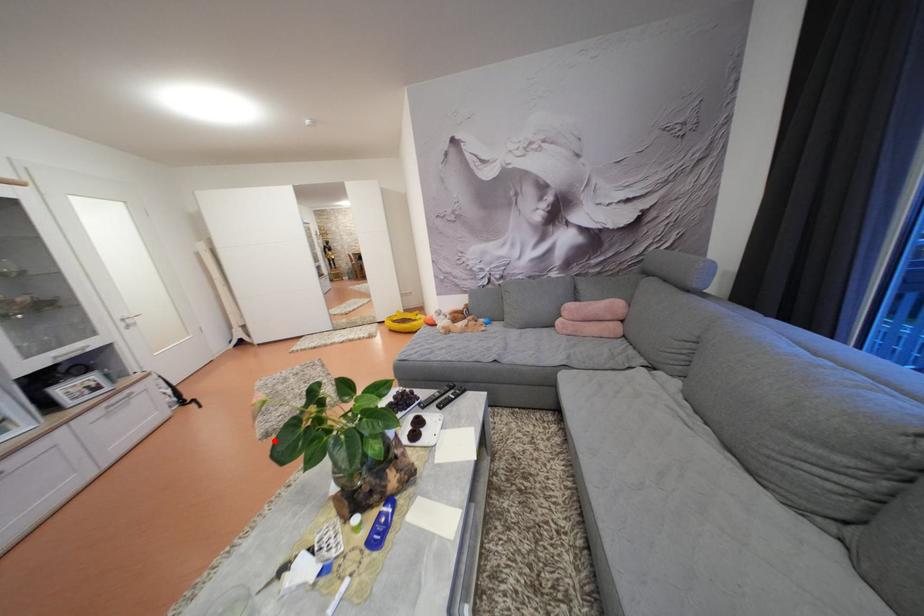
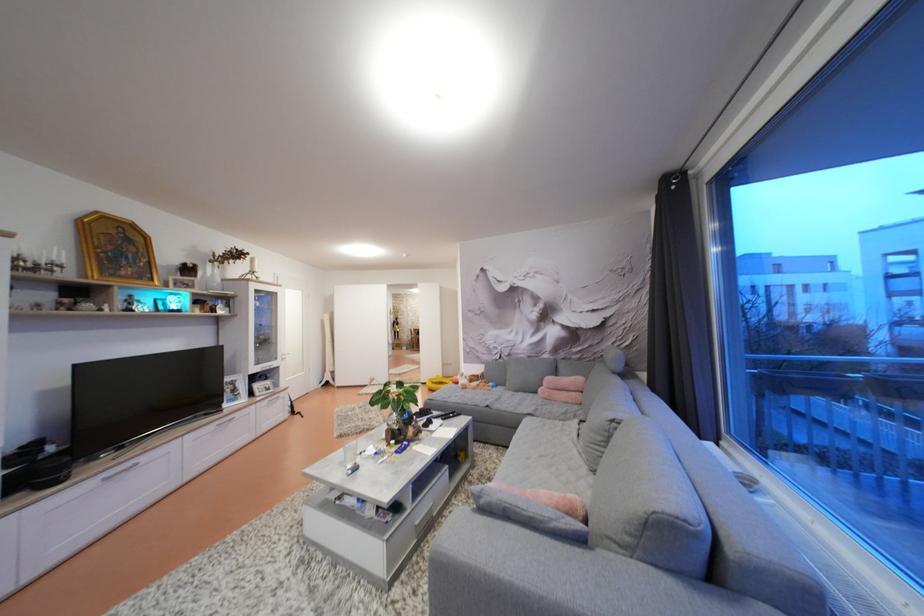
In the second image, find the point that corresponds to the highlighted location in the first image.

(348, 440)